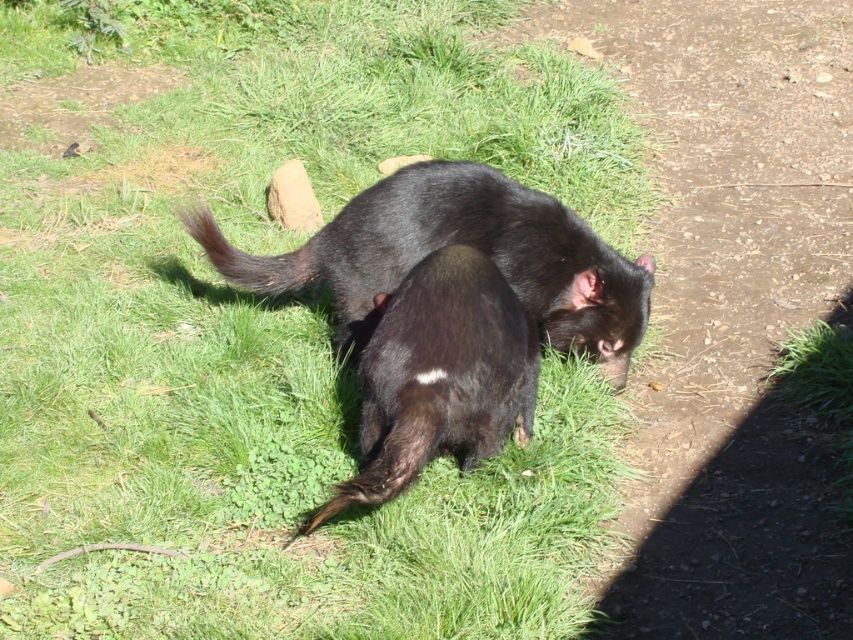
Question: Which point is closer to the camera?

Choices:
 (A) dark brown fur tail at upper center
 (B) shiny black tasmanian devil at center
 (C) black furry tail at lower center
 (D) black furry tasmanian devil at center

Answer: (C)

Question: Observing the image, what is the correct spatial positioning of shiny black tasmanian devil at center in reference to black furry tasmanian devil at center?

Choices:
 (A) left
 (B) right

Answer: (A)

Question: Does black furry tasmanian devil at center have a lesser width compared to dark brown fur tail at upper center?

Choices:
 (A) yes
 (B) no

Answer: (B)

Question: Which object is the closest to the dark brown fur tail at upper center?

Choices:
 (A) shiny black tasmanian devil at center
 (B) black furry tail at lower center

Answer: (A)

Question: Is shiny black tasmanian devil at center further to camera compared to dark brown fur tail at upper center?

Choices:
 (A) no
 (B) yes

Answer: (A)

Question: Which object is the closest to the black furry tasmanian devil at center?

Choices:
 (A) dark brown fur tail at upper center
 (B) black furry tail at lower center

Answer: (B)